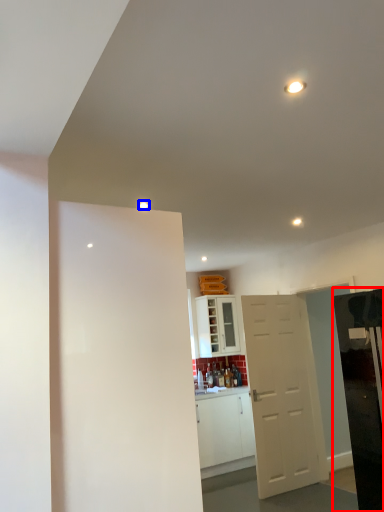
Question: Which object appears closest to the camera in this image, appliance (highlighted by a red box) or light (highlighted by a blue box)?

Choices:
 (A) appliance
 (B) light

Answer: (A)